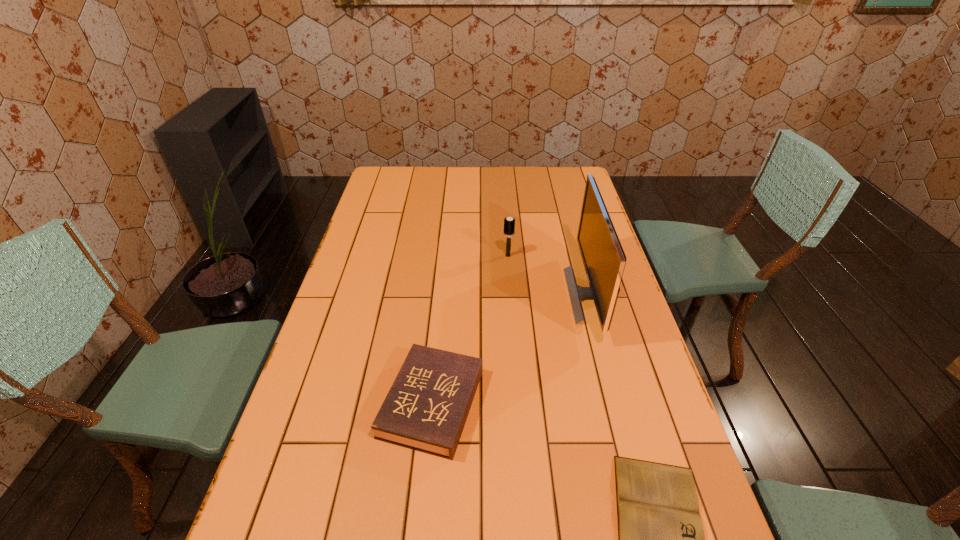
Identify the location of free point that satisfies the following two spatial constraints: 1. on the screen side of the tallest object; 2. on the front side of the hardback book. click(x=621, y=403).